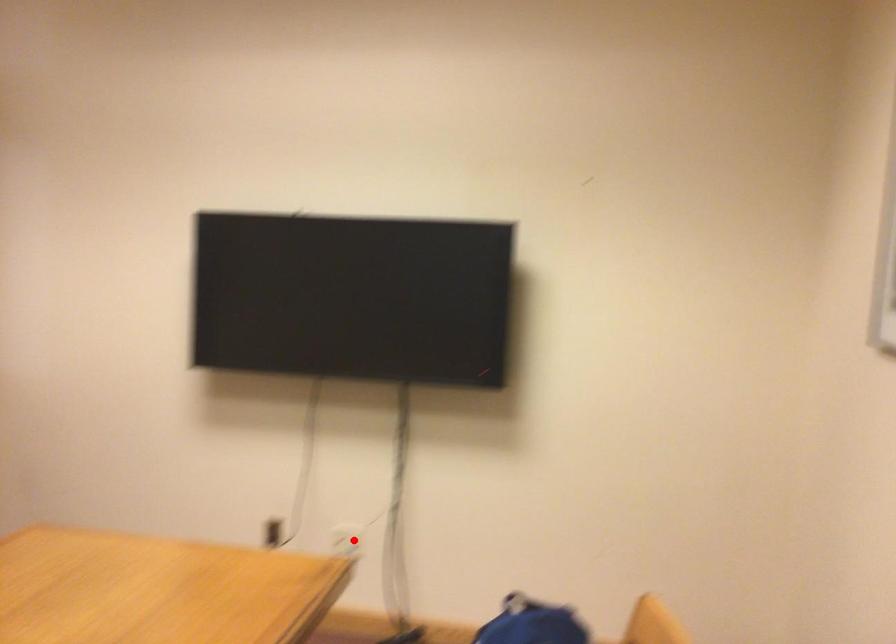
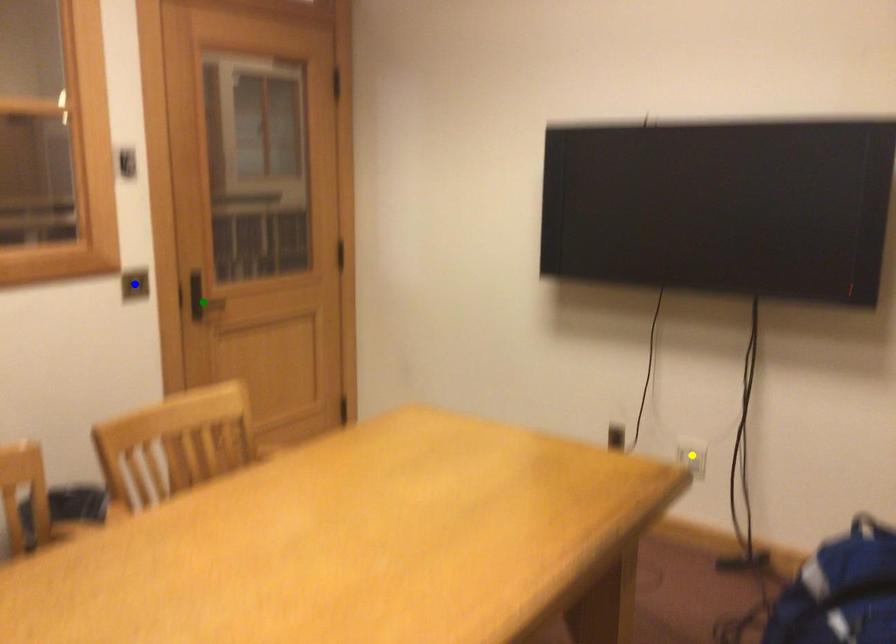
Question: I am providing you with two images of the same scene from different viewpoints. A red point is marked on the first image. You are given multiple points on the second image. Can you choose the point in image 2 that corresponds to the point in image 1?

Choices:
 (A) blue point
 (B) yellow point
 (C) green point

Answer: (B)